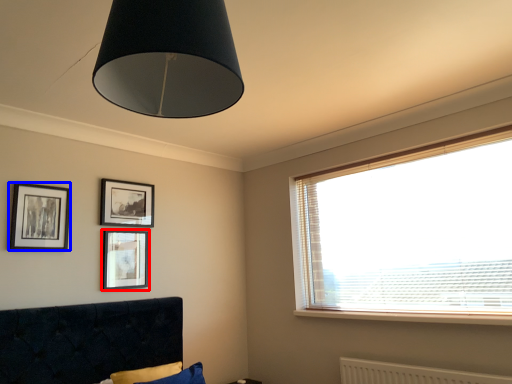
Question: Which of the following is the farthest to the observer, picture frame (highlighted by a red box) or picture frame (highlighted by a blue box)?

Choices:
 (A) picture frame
 (B) picture frame

Answer: (A)